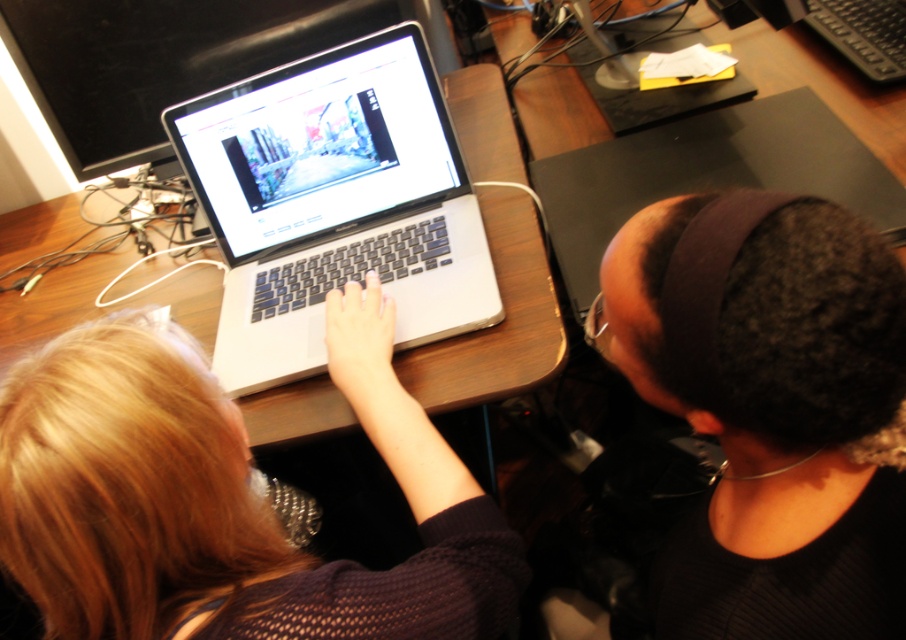
Question: Which of the following is the farthest from the observer?

Choices:
 (A) wooden table at center
 (B) blonde hair at center

Answer: (A)

Question: Which point appears farthest from the camera in this image?

Choices:
 (A) (355, 150)
 (B) (579, 154)
 (C) (347, 324)
 (D) (455, 368)

Answer: (B)

Question: Which object is positioned farthest from the blonde hair at center?

Choices:
 (A) wooden table at center
 (B) sleek silver laptop at center

Answer: (B)

Question: Can you confirm if blonde hair at center is bigger than sleek silver laptop at center?

Choices:
 (A) yes
 (B) no

Answer: (A)

Question: Where is blonde hair at center located in relation to silver/black laptop at center in the image?

Choices:
 (A) above
 (B) below

Answer: (B)

Question: Is blonde hair at center positioned at the back of silver/black laptop at center?

Choices:
 (A) no
 (B) yes

Answer: (A)